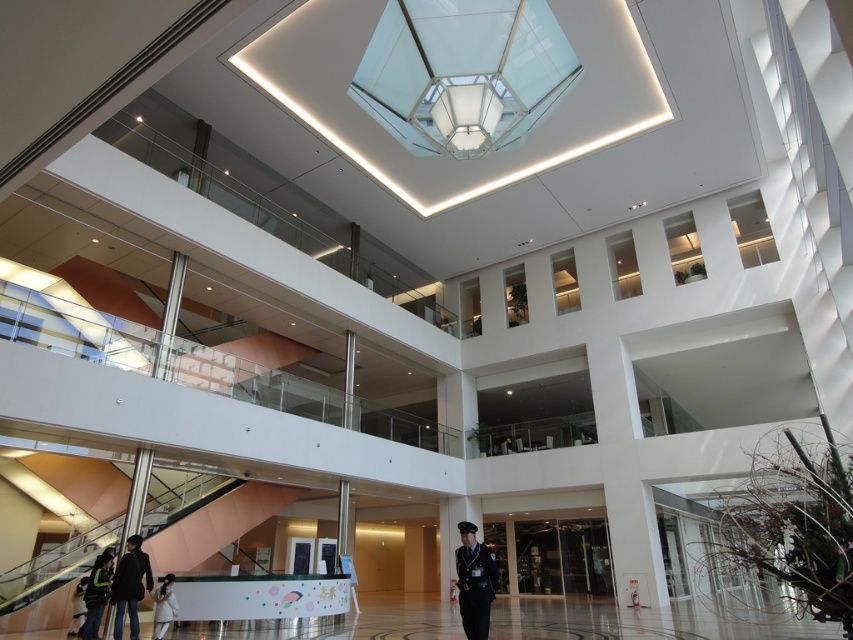
You are a security guard assigned to patrol the central atrium. You see the uniformed officer at center and the dark gray fabric jacket at lower left. Which object is closer to you as you stand at the entrance?

The uniformed officer at center is closer to you because they are positioned in front of the dark gray fabric jacket at lower left.

You are a security guard assigned to monitor the central atrium. You notice the uniformed officer at center and the dark gray fabric jacket at lower left. Which object takes up more space in the scene?

The dark gray fabric jacket at lower left takes up more space than the uniformed officer at center.

Looking at this image, you are a visitor to the mall and you see the uniformed officer at center and the white fuzzy coat at lower left. Which object is bigger in size?

The white fuzzy coat at lower left is bigger in size compared to the uniformed officer at center.